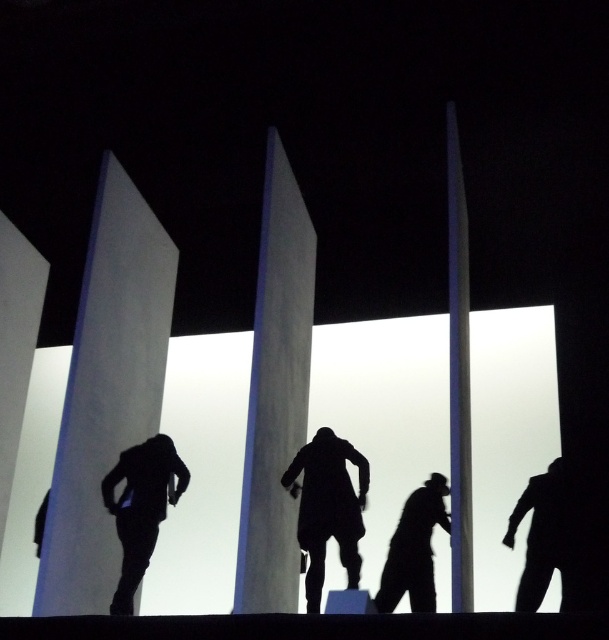
Consider the image. You are a photographer standing at the edge of the scene. You want to capture a photo where the smooth white pillar at center and the black matte suit at lower right are both clearly visible. Given that your camera can focus on objects within a 4 feet range, will both subjects be in focus?

The smooth white pillar at center is 4.53 feet away from the black matte suit at lower right. Since the distance between them is greater than 4 feet, the camera might not be able to keep both in focus simultaneously.